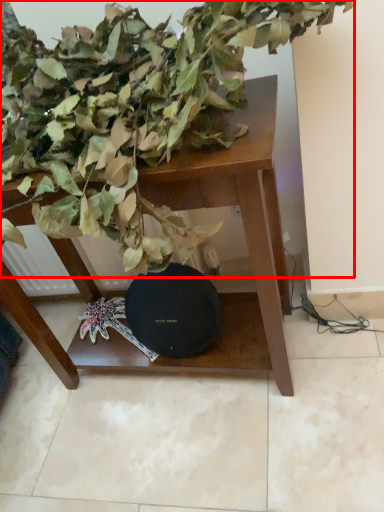
Question: From the image, what is the correct spatial relationship of houseplant (annotated by the red box) in relation to table?

Choices:
 (A) left
 (B) right

Answer: (A)